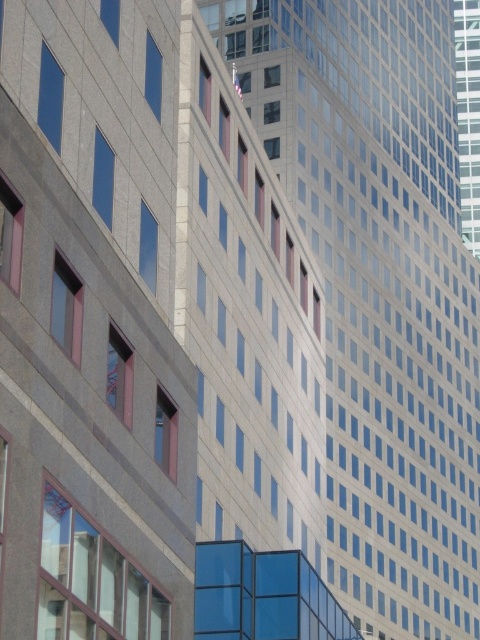
You are a drone operator tasked with flying a drone between the smooth glass skyscraper at center and the glassy reflective skyscraper at upper right. The drone has a maximum flight distance of 30 meters. Can the drone safely complete this flight without exceeding its range?

The distance between the smooth glass skyscraper at center and the glassy reflective skyscraper at upper right is 28.47 meters, which is within the drone operator drone maximum flight distance of 30 meters. Therefore, the drone can safely complete the flight between them without exceeding its range.